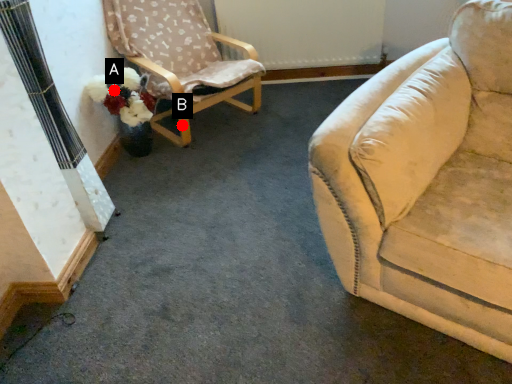
Question: Two points are circled on the image, labeled by A and B beside each circle. Which of the following is the farthest from the observer?

Choices:
 (A) A is further
 (B) B is further

Answer: (B)